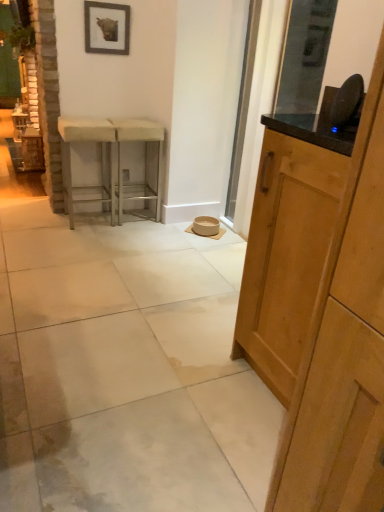
Question: Can you confirm if white fabric stool at left, which is counted as the 2th stool, starting from the right, is thinner than metallic silver stool at center, marked as the 1th stool in a right-to-left arrangement?

Choices:
 (A) no
 (B) yes

Answer: (A)

Question: Is white fabric stool at left, the 1th stool when ordered from left to right, taller than metallic silver stool at center, marked as the 2th stool in a left-to-right arrangement?

Choices:
 (A) no
 (B) yes

Answer: (A)

Question: Can you confirm if white fabric stool at left, the 1th stool when ordered from left to right, is shorter than metallic silver stool at center, marked as the 2th stool in a left-to-right arrangement?

Choices:
 (A) no
 (B) yes

Answer: (B)

Question: From a real-world perspective, is white fabric stool at left, the 1th stool when ordered from left to right, located beneath metallic silver stool at center, marked as the 1th stool in a right-to-left arrangement?

Choices:
 (A) yes
 (B) no

Answer: (A)

Question: Does white fabric stool at left, which is counted as the 2th stool, starting from the right, contain metallic silver stool at center, marked as the 2th stool in a left-to-right arrangement?

Choices:
 (A) no
 (B) yes

Answer: (A)

Question: From a real-world perspective, is white fabric stool at left, which is counted as the 2th stool, starting from the right, positioned over metallic silver stool at center, marked as the 1th stool in a right-to-left arrangement, based on gravity?

Choices:
 (A) yes
 (B) no

Answer: (B)

Question: Does wooden frame at upper center have a greater height compared to white polished concrete at center?

Choices:
 (A) no
 (B) yes

Answer: (B)

Question: Could white polished concrete at center be considered to be inside wooden frame at upper center?

Choices:
 (A) yes
 (B) no

Answer: (B)

Question: From the image's perspective, is wooden frame at upper center located above white polished concrete at center?

Choices:
 (A) yes
 (B) no

Answer: (A)

Question: Would you say wooden frame at upper center is outside white polished concrete at center?

Choices:
 (A) yes
 (B) no

Answer: (A)

Question: From the image's perspective, is wooden frame at upper center located beneath white polished concrete at center?

Choices:
 (A) no
 (B) yes

Answer: (A)

Question: Considering the relative positions of wooden frame at upper center and white polished concrete at center in the image provided, is wooden frame at upper center to the left of white polished concrete at center from the viewer's perspective?

Choices:
 (A) yes
 (B) no

Answer: (B)

Question: Could white fabric stool at left, the 1th stool when ordered from left to right, be considered to be inside light wood cabinet at right?

Choices:
 (A) no
 (B) yes

Answer: (A)